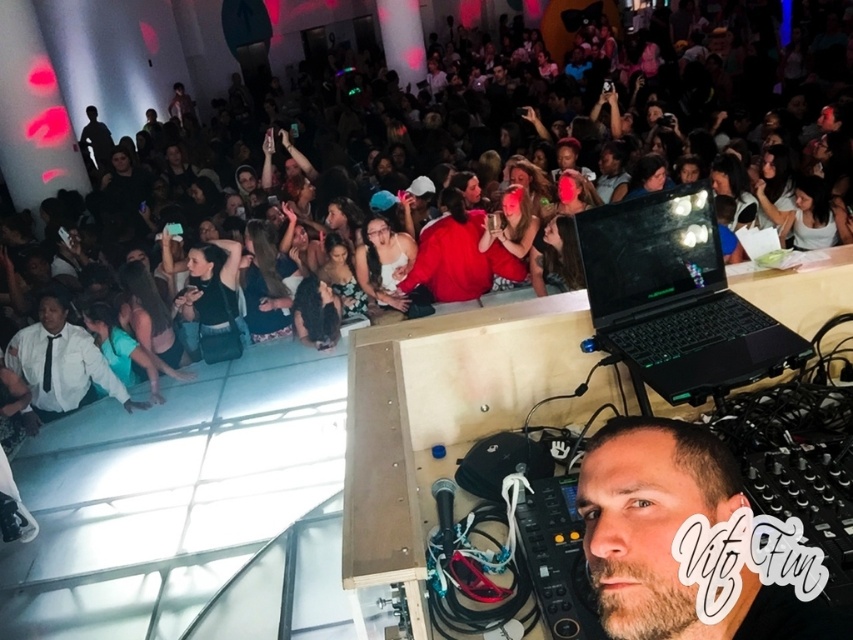
Which is above, glossy black laptop at center or white shirt at lower left?

Positioned higher is glossy black laptop at center.

Can you confirm if glossy black laptop at center is positioned above white shirt at lower left?

Correct, glossy black laptop at center is located above white shirt at lower left.

Which is in front, point (659, 218) or point (55, 317)?

Point (659, 218) is more forward.

The width and height of the screenshot is (853, 640). I want to click on glossy black laptop at center, so click(674, 300).

Which is in front, point (627, 632) or point (717, 355)?

Positioned in front is point (627, 632).

Is beige matte face at center above glossy black laptop at center?

No.

Is point (809, 616) closer to camera compared to point (677, 330)?

Yes, point (809, 616) is in front of point (677, 330).

Where is `beige matte face at center`? This screenshot has width=853, height=640. beige matte face at center is located at coordinates (672, 538).

Can you confirm if beige matte face at center is positioned to the left of white shirt at lower left?

Incorrect, beige matte face at center is not on the left side of white shirt at lower left.

Is point (700, 440) in front of point (44, 308)?

Yes, it is.

Locate an element on the screen. beige matte face at center is located at coordinates (672, 538).